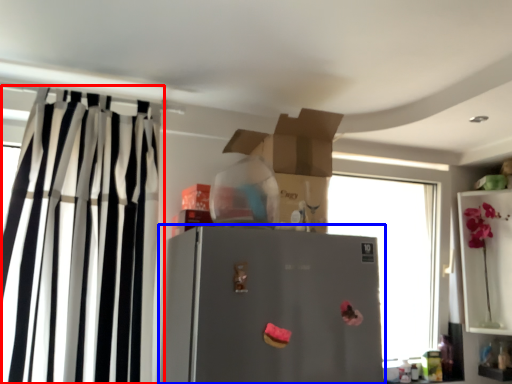
Question: Which point is further to the camera, curtain (highlighted by a red box) or refrigerator (highlighted by a blue box)?

Choices:
 (A) curtain
 (B) refrigerator

Answer: (A)